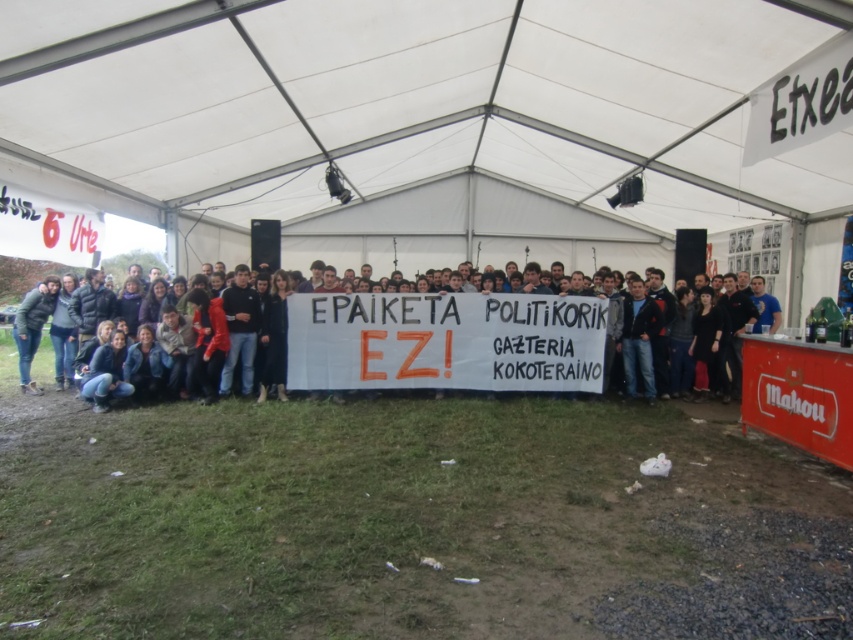
You are a photographer trying to capture a photo of the dark brown leather jacket at center without the white fabric canopy at center blocking the view. Is it possible to take such a photo from a lower angle?

The white fabric canopy at center is much taller than the dark brown leather jacket at center, so yes, you can take a photo of the dark brown leather jacket at center from a lower angle without the canopy blocking the view.

You are a photographer at the event and want to capture a photo of the dark brown leather jacket at center without the white paper banner at center blocking it. How should you adjust your camera angle?

To avoid the white paper banner at center blocking the dark brown leather jacket at center, you should lower your camera angle since the banner is positioned above the jacket.

You are a photographer trying to capture the banner and the jacket in the scene. Given that the white paper banner at center is narrower than the dark brown leather jacket at center, which object would you need to position closer to the camera to ensure both fill the frame equally?

Since the white paper banner at center is narrower than the dark brown leather jacket at center, you would need to position the white paper banner at center closer to the camera to ensure both fill the frame equally.